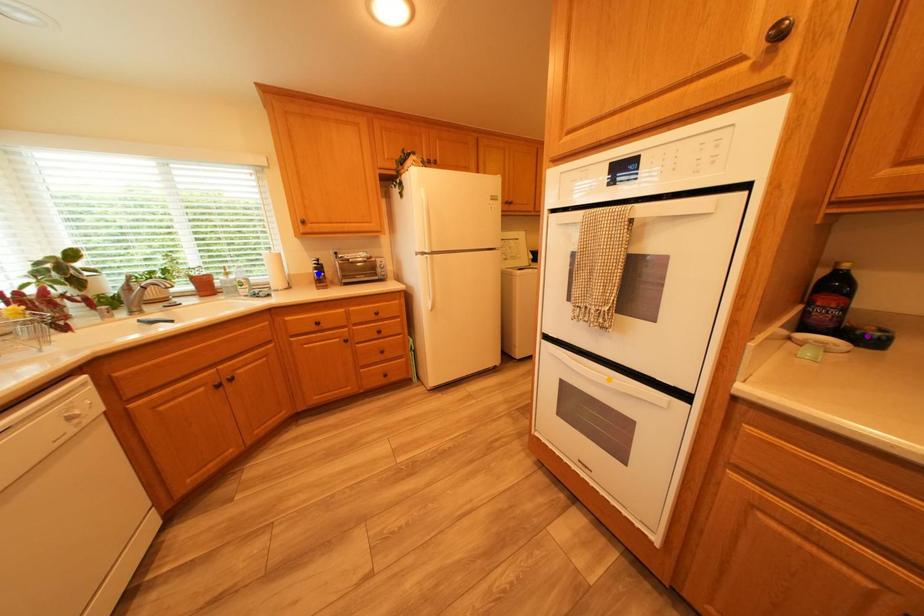
Order these from nearest to farthest:
blue point, orange point, purple point

purple point
orange point
blue point